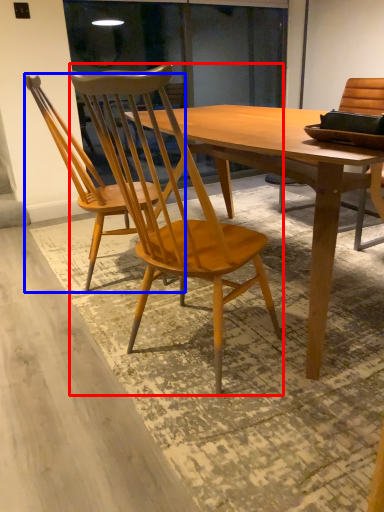
Question: Which point is closer to the camera, chair (highlighted by a red box) or chair (highlighted by a blue box)?

Choices:
 (A) chair
 (B) chair

Answer: (A)